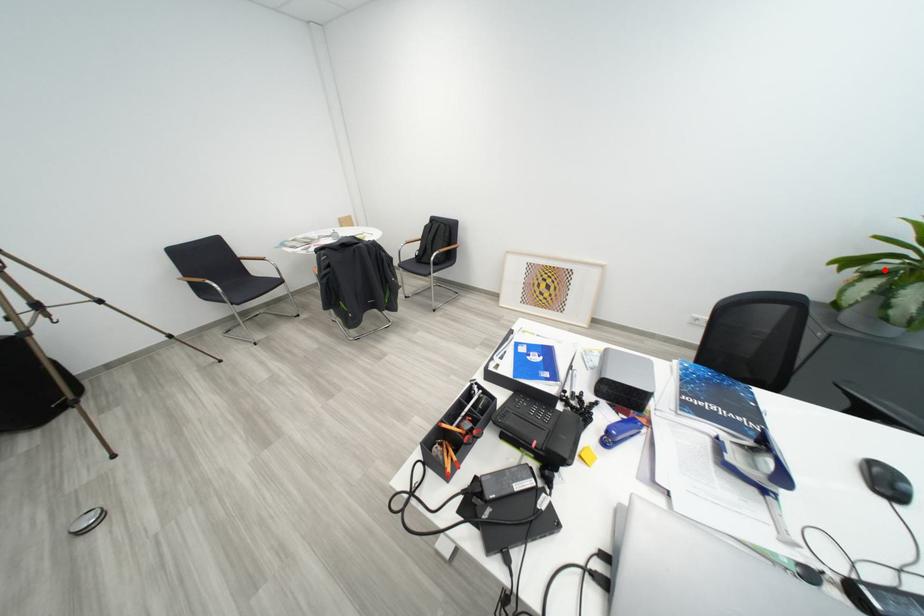
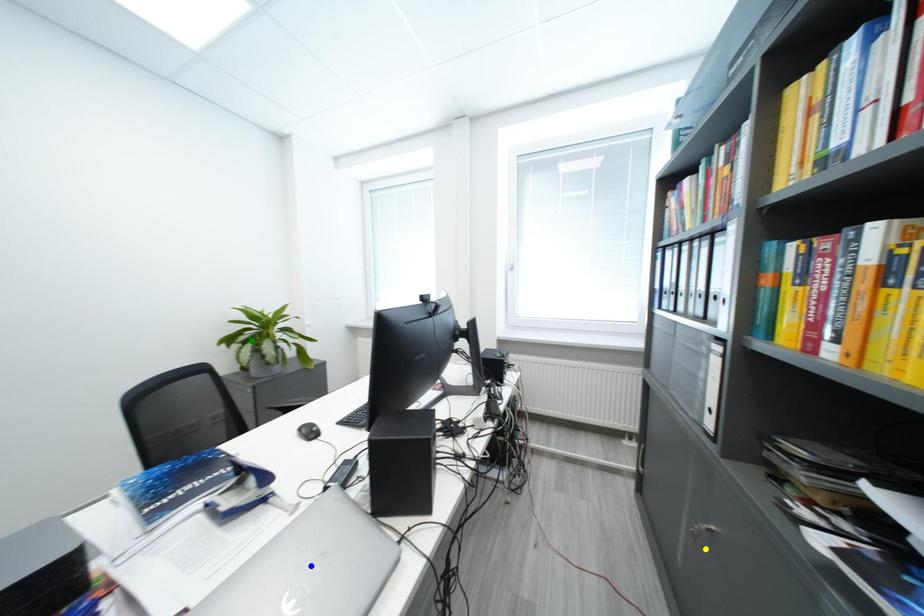
Question: I am providing you with two images of the same scene from different viewpoints. A red point is marked on the first image. You are given multiple points on the second image. In image 2, which mark is for the same physical point as the one in image 1?

Choices:
 (A) yellow point
 (B) blue point
 (C) green point

Answer: (C)